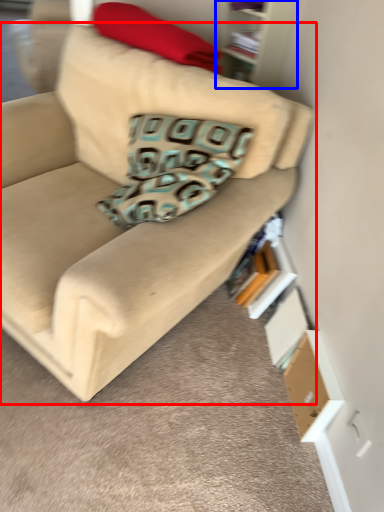
Question: Among these objects, which one is farthest to the camera, studio couch (highlighted by a red box) or bookshelf (highlighted by a blue box)?

Choices:
 (A) studio couch
 (B) bookshelf

Answer: (B)